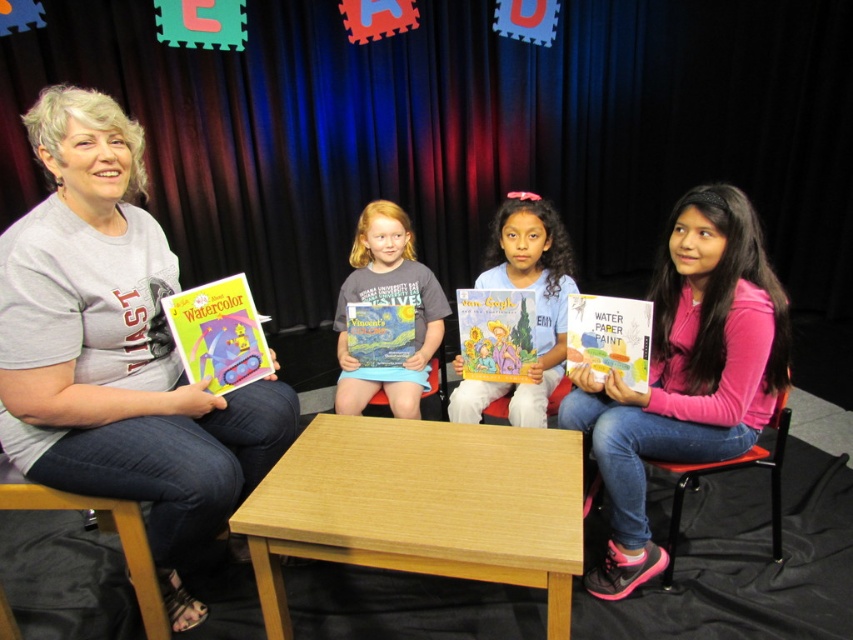
Question: Which point is closer to the camera?

Choices:
 (A) matte paper book at center
 (B) gray cotton shirt at center
 (C) wooden chair at center

Answer: (A)

Question: Which of the following is the closest to the observer?

Choices:
 (A) matte paper book at left
 (B) wooden chair at left
 (C) red plastic chair at lower right
 (D) pink zip-up jacket at right

Answer: (B)

Question: Does pink zip-up jacket at right have a lesser width compared to white matte book at center?

Choices:
 (A) no
 (B) yes

Answer: (A)

Question: Which is farther from the gray cotton shirt at center?

Choices:
 (A) matte paper book at center
 (B) matte blue book at center

Answer: (A)

Question: Does matte blue book at center appear over gray cotton shirt at center?

Choices:
 (A) no
 (B) yes

Answer: (A)

Question: Can you confirm if light brown wood table at center is wider than pink zip-up jacket at right?

Choices:
 (A) yes
 (B) no

Answer: (A)